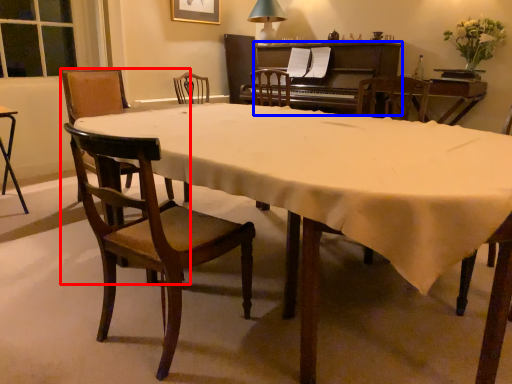
Question: Which point is closer to the camera, chair (highlighted by a red box) or piano (highlighted by a blue box)?

Choices:
 (A) chair
 (B) piano

Answer: (A)